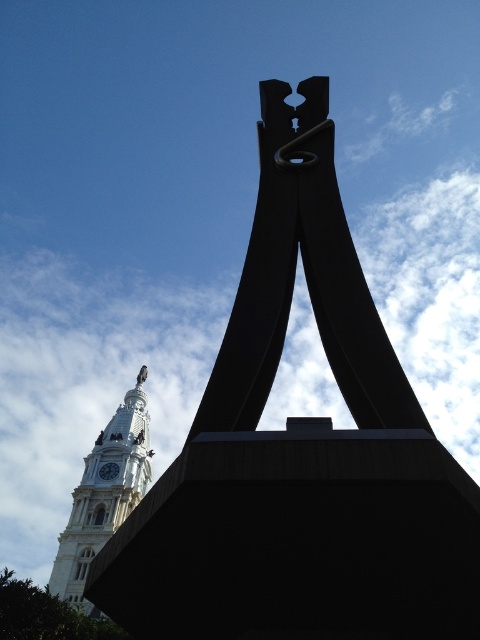
Question: Does white stone clock tower at lower left appear on the left side of gold metallic clock at upper left?

Choices:
 (A) no
 (B) yes

Answer: (B)

Question: Does black matte sculpture at center have a smaller size compared to white stone clock tower at lower left?

Choices:
 (A) yes
 (B) no

Answer: (B)

Question: In this image, where is black matte sculpture at center located relative to gold metallic clock at upper left?

Choices:
 (A) above
 (B) below

Answer: (A)

Question: Estimate the real-world distances between objects in this image. Which object is farther from the black matte sculpture at center?

Choices:
 (A) gold metallic clock at upper left
 (B) white stone clock tower at lower left

Answer: (A)

Question: Which object is farther from the camera taking this photo?

Choices:
 (A) gold metallic clock at upper left
 (B) white stone clock tower at lower left

Answer: (A)

Question: Estimate the real-world distances between objects in this image. Which object is farther from the white stone clock tower at lower left?

Choices:
 (A) gold metallic clock at upper left
 (B) black matte sculpture at center

Answer: (B)